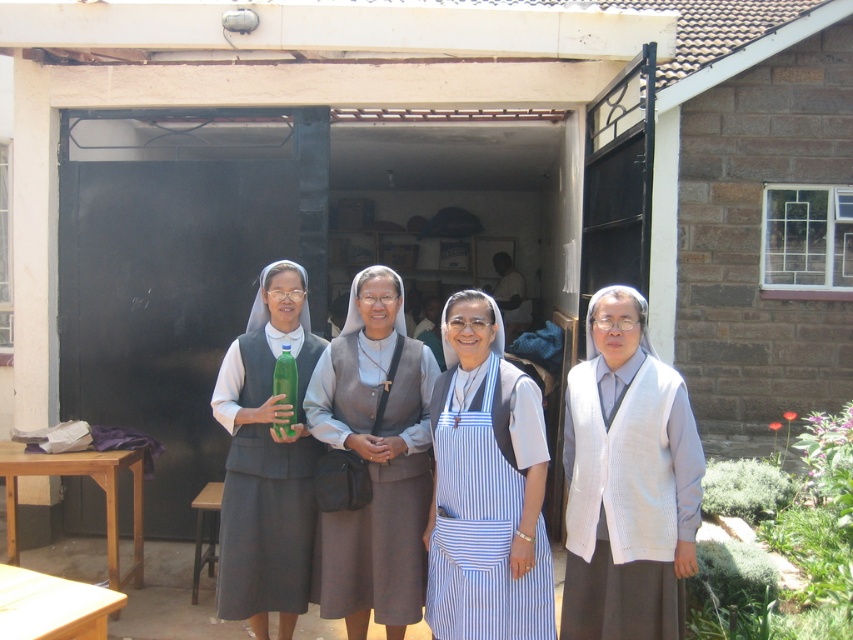
You are a photographer standing 5 meters away from the blue striped apron at center. You want to take a closeup shot of it. Is the apron within your camera range if your camera can focus up to 4 meters?

The blue striped apron at center is 3.70 meters away from the camera. Since the camera can focus up to 4 meters, the apron is within the camera range and can be captured in focus.

You are a photographer trying to capture a group photo of the four nuns. You notice the white knitted vest at center and the matte gray dress at center. Which one is located to the right of the other?

The white knitted vest at center is positioned on the right side of matte gray dress at center.

You are a photographer trying to capture a photo of the group. You notice the blue striped apron at center and the brown fabric dress at center. Which one should you adjust to ensure both are fully visible in the frame?

The blue striped apron at center is above the brown fabric dress at center, so adjusting the camera angle slightly downward might help ensure both are visible without one blocking the other.